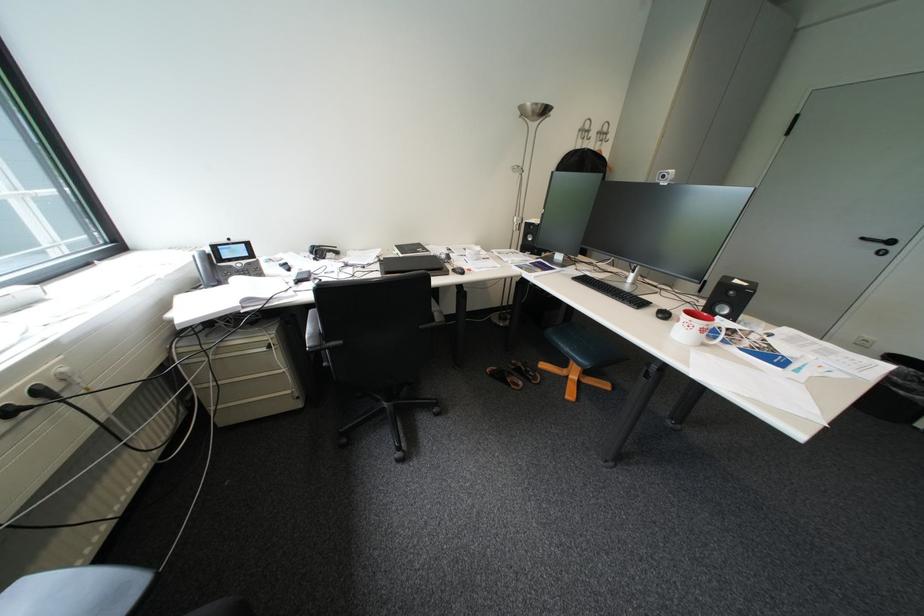
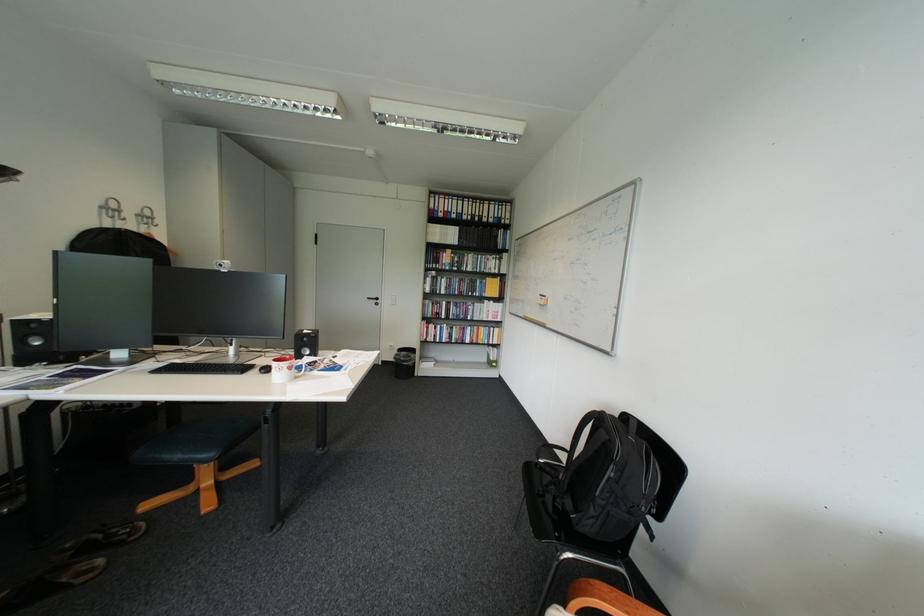
The point at [744,293] is marked in the first image. Where is the corresponding point in the second image?

(317, 339)